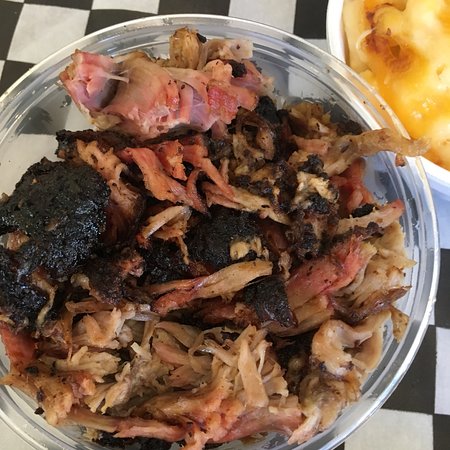
Where is `plastic bowl`? Image resolution: width=450 pixels, height=450 pixels. plastic bowl is located at coordinates (20, 425), (421, 207).